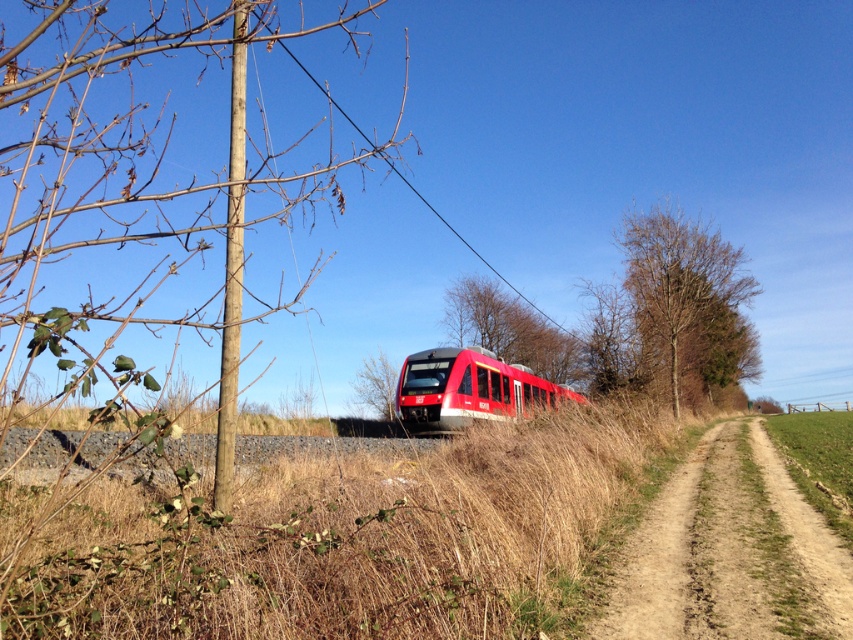
Question: Which object is the farthest from the brown leafless tree at center?

Choices:
 (A) dry grass at center
 (B) brown sandy dirt track at lower right

Answer: (A)

Question: Does bare wood tree at right have a lesser width compared to smooth bark tree at center?

Choices:
 (A) no
 (B) yes

Answer: (A)

Question: Which is farther from the smooth wooden pole at center-left?

Choices:
 (A) red matte train at center
 (B) dry grass at center
 (C) bare wood tree at right
 (D) black wire at upper center

Answer: (C)

Question: Considering the real-world distances, which object is farthest from the brown leafless tree at center?

Choices:
 (A) smooth bark tree at center
 (B) bare wood tree at right
 (C) red matte train at center
 (D) smooth wooden pole at center-left

Answer: (D)

Question: Can you confirm if red matte train at center is positioned above brown leafless tree at center?

Choices:
 (A) no
 (B) yes

Answer: (B)

Question: Is dry grass at center positioned in front of smooth bark tree at center?

Choices:
 (A) no
 (B) yes

Answer: (B)